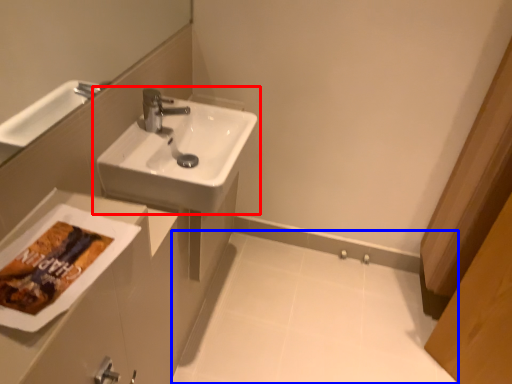
Question: Which point is closer to the camera, sink (highlighted by a red box) or porcelain (highlighted by a blue box)?

Choices:
 (A) sink
 (B) porcelain

Answer: (A)